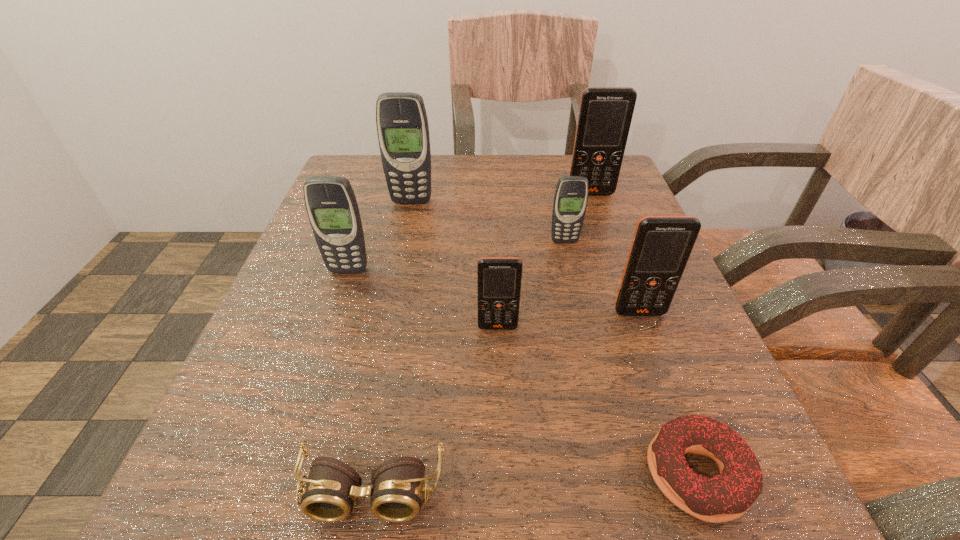
Identify the location of orange cellular telephone that is the second closest to the farthest object. This screenshot has width=960, height=540. (499, 279).

Locate an element on the screen. This screenshot has height=540, width=960. the second closest gray cellular telephone to the nearest gray cellular telephone is located at coordinates (571, 195).

The height and width of the screenshot is (540, 960). Find the location of `gray cellular telephone that can be found as the closest to the sixth nearest object`. gray cellular telephone that can be found as the closest to the sixth nearest object is located at coordinates (402, 125).

This screenshot has height=540, width=960. Identify the location of vacant space that satisfies the following two spatial constraints: 1. on the screen of the doughnut; 2. on the left side of the nearest gray cellular telephone. (280, 474).

At what (x,y) coordinates should I click in order to perform the action: click on free region that satisfies the following two spatial constraints: 1. on the screen of the chocolate doughnut; 2. on the right side of the smallest orange cellular telephone. Please return your answer as a coordinate pair (x, y). The width and height of the screenshot is (960, 540). Looking at the image, I should click on (503, 474).